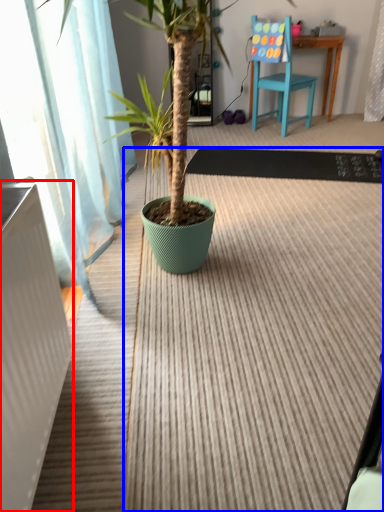
Question: Among these objects, which one is nearest to the camera, radiator (highlighted by a red box) or doormat (highlighted by a blue box)?

Choices:
 (A) radiator
 (B) doormat

Answer: (A)